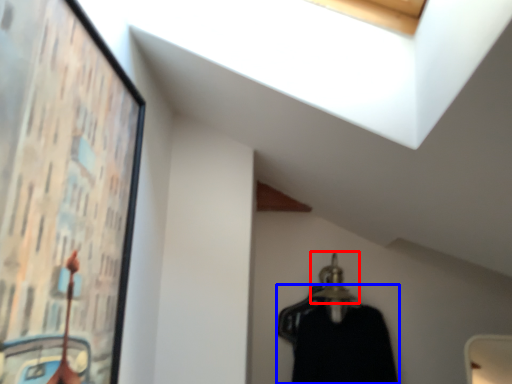
Question: Which of the following is the farthest to the observer, hanger (highlighted by a red box) or clothing (highlighted by a blue box)?

Choices:
 (A) hanger
 (B) clothing

Answer: (A)